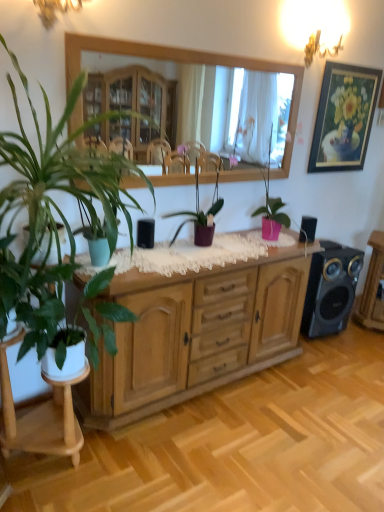
You are a GUI agent. You are given a task and a screenshot of the screen. Output one action in this format:
    pyautogui.click(x=<x>, y=<y>)
    Task: Click on the vacant area that is situated to the right of wooden cabinet at center
    This screenshot has width=384, height=512.
    Given the screenshot: What is the action you would take?
    pyautogui.click(x=318, y=390)